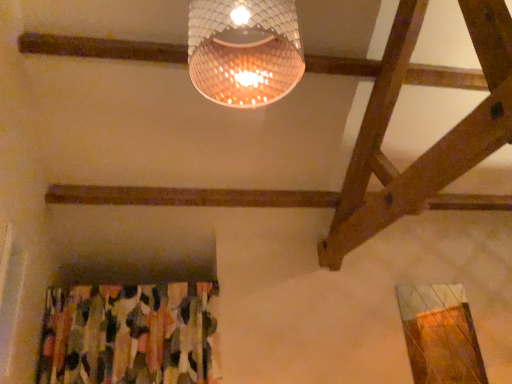
Question: Is translucent woven lampshade at upper center bigger than abstract fabric curtain at lower left?

Choices:
 (A) no
 (B) yes

Answer: (A)

Question: Is translucent woven lampshade at upper center to the left of abstract fabric curtain at lower left from the viewer's perspective?

Choices:
 (A) no
 (B) yes

Answer: (A)

Question: Does translucent woven lampshade at upper center have a greater height compared to abstract fabric curtain at lower left?

Choices:
 (A) yes
 (B) no

Answer: (B)

Question: Is the depth of translucent woven lampshade at upper center greater than that of abstract fabric curtain at lower left?

Choices:
 (A) no
 (B) yes

Answer: (A)

Question: Is translucent woven lampshade at upper center not inside abstract fabric curtain at lower left?

Choices:
 (A) yes
 (B) no

Answer: (A)

Question: Is translucent woven lampshade at upper center at the right side of abstract fabric curtain at lower left?

Choices:
 (A) no
 (B) yes

Answer: (B)

Question: From a real-world perspective, is abstract fabric curtain at lower left positioned under translucent woven lampshade at upper center based on gravity?

Choices:
 (A) yes
 (B) no

Answer: (A)

Question: Is abstract fabric curtain at lower left oriented towards translucent woven lampshade at upper center?

Choices:
 (A) yes
 (B) no

Answer: (B)

Question: Is abstract fabric curtain at lower left at the left side of translucent woven lampshade at upper center?

Choices:
 (A) no
 (B) yes

Answer: (B)

Question: Is abstract fabric curtain at lower left taller than translucent woven lampshade at upper center?

Choices:
 (A) no
 (B) yes

Answer: (B)

Question: Is translucent woven lampshade at upper center completely or partially inside abstract fabric curtain at lower left?

Choices:
 (A) yes
 (B) no

Answer: (B)

Question: Is the depth of abstract fabric curtain at lower left greater than that of translucent woven lampshade at upper center?

Choices:
 (A) yes
 (B) no

Answer: (A)

Question: Considering the positions of abstract fabric curtain at lower left and translucent woven lampshade at upper center in the image, is abstract fabric curtain at lower left taller or shorter than translucent woven lampshade at upper center?

Choices:
 (A) short
 (B) tall

Answer: (B)